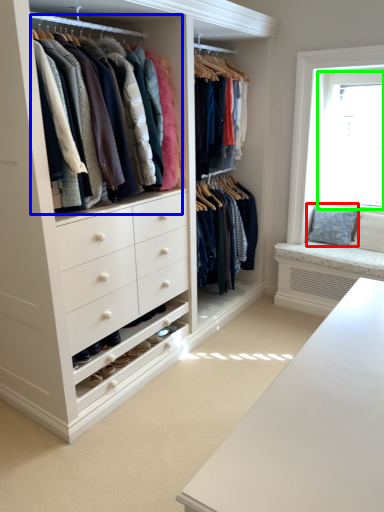
Question: Considering the real-world distances, which object is farthest from pillow (highlighted by a red box)? closet (highlighted by a blue box) or bay window (highlighted by a green box)?

Choices:
 (A) closet
 (B) bay window

Answer: (A)